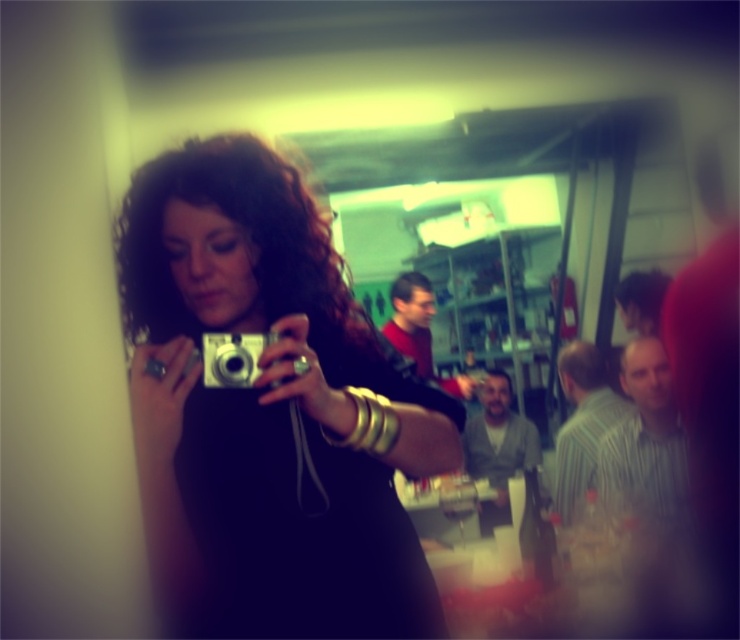
Question: Where is matte black dress at center located in relation to silver metallic camera at center in the image?

Choices:
 (A) right
 (B) left

Answer: (A)

Question: Among these points, which one is nearest to the camera?

Choices:
 (A) (195, 600)
 (B) (259, 369)

Answer: (B)

Question: Considering the relative positions of matte black dress at center and silver metallic camera at center in the image provided, where is matte black dress at center located with respect to silver metallic camera at center?

Choices:
 (A) below
 (B) above

Answer: (A)

Question: Among these objects, which one is farthest from the camera?

Choices:
 (A) matte black dress at center
 (B) silver metallic camera at center

Answer: (B)

Question: Where is matte black dress at center located in relation to silver metallic camera at center in the image?

Choices:
 (A) left
 (B) right

Answer: (B)